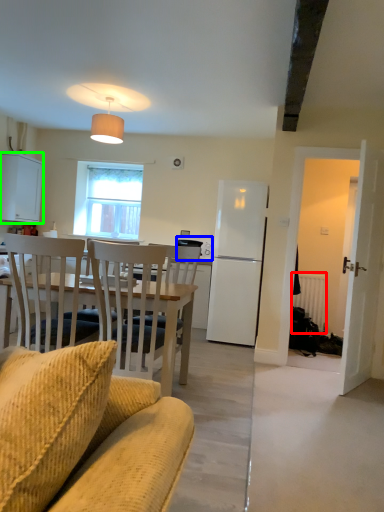
Question: Estimate the real-world distances between objects in this image. Which object is farther from radiator (highlighted by a red box), microwave oven (highlighted by a blue box) or cabinetry (highlighted by a green box)?

Choices:
 (A) microwave oven
 (B) cabinetry

Answer: (B)